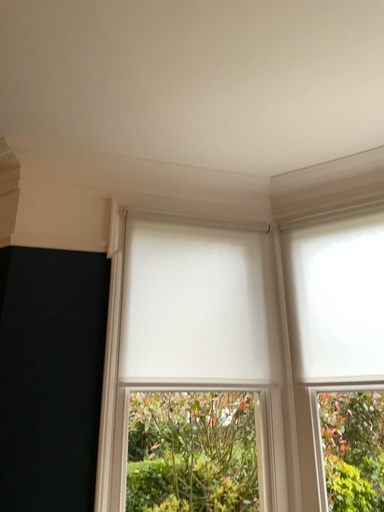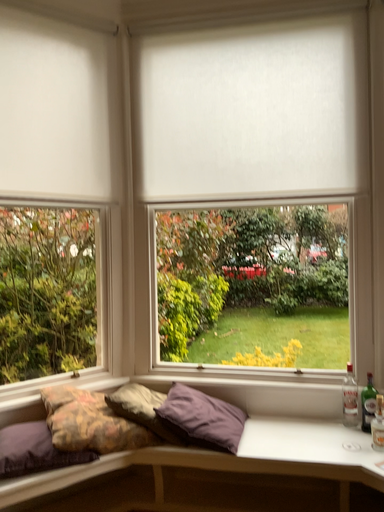
Question: How did the camera likely rotate when shooting the video?

Choices:
 (A) rotated downward
 (B) rotated upward

Answer: (A)